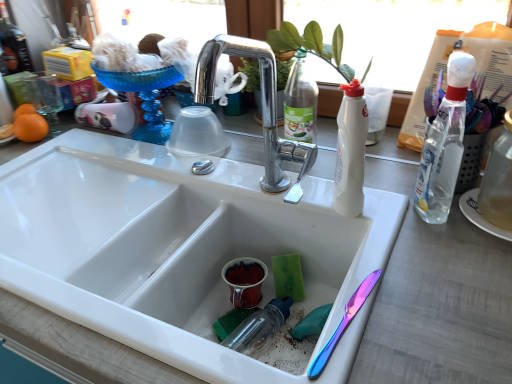
Question: Should I look upward or downward to see white matte bottle at center, which appears as the 1th bottle when viewed from the left?

Choices:
 (A) up
 (B) down

Answer: (A)

Question: Is white matte bottle at center, which appears as the 1th bottle when viewed from the left, thinner than clear plastic bottle at right, the 2th bottle from the left?

Choices:
 (A) yes
 (B) no

Answer: (B)

Question: Is clear plastic bottle at right, the 2th bottle from the left, at the back of white matte bottle at center, the 3th bottle positioned from the right?

Choices:
 (A) yes
 (B) no

Answer: (B)

Question: Considering the relative positions of white matte bottle at center, which appears as the 1th bottle when viewed from the left, and clear plastic bottle at right, the 2th bottle from the left, in the image provided, is white matte bottle at center, which appears as the 1th bottle when viewed from the left, behind clear plastic bottle at right, the 2th bottle from the left,?

Choices:
 (A) yes
 (B) no

Answer: (A)

Question: Is white matte bottle at center, which appears as the 1th bottle when viewed from the left, bigger than clear plastic bottle at right, the second bottle when ordered from right to left?

Choices:
 (A) no
 (B) yes

Answer: (A)

Question: From the image's perspective, is white matte bottle at center, which appears as the 1th bottle when viewed from the left, on top of clear plastic bottle at right, the 2th bottle from the left?

Choices:
 (A) no
 (B) yes

Answer: (A)

Question: Is white matte bottle at center, the 3th bottle positioned from the right, aimed at clear plastic bottle at right, the 2th bottle from the left?

Choices:
 (A) yes
 (B) no

Answer: (B)

Question: From a real-world perspective, is white glossy sink at center on green leafy plant at upper center?

Choices:
 (A) yes
 (B) no

Answer: (B)

Question: Is white glossy sink at center aimed at green leafy plant at upper center?

Choices:
 (A) no
 (B) yes

Answer: (A)

Question: Does white glossy sink at center come behind green leafy plant at upper center?

Choices:
 (A) yes
 (B) no

Answer: (B)

Question: Can you confirm if white glossy sink at center is bigger than green leafy plant at upper center?

Choices:
 (A) yes
 (B) no

Answer: (A)

Question: Is white glossy sink at center smaller than green leafy plant at upper center?

Choices:
 (A) no
 (B) yes

Answer: (A)

Question: Is white glossy sink at center positioned before green leafy plant at upper center?

Choices:
 (A) no
 (B) yes

Answer: (B)

Question: From the image's perspective, is clear glass bottle at right, positioned as the first bottle in right-to-left order, located above white matte bottle at center, which appears as the 1th bottle when viewed from the left?

Choices:
 (A) yes
 (B) no

Answer: (B)